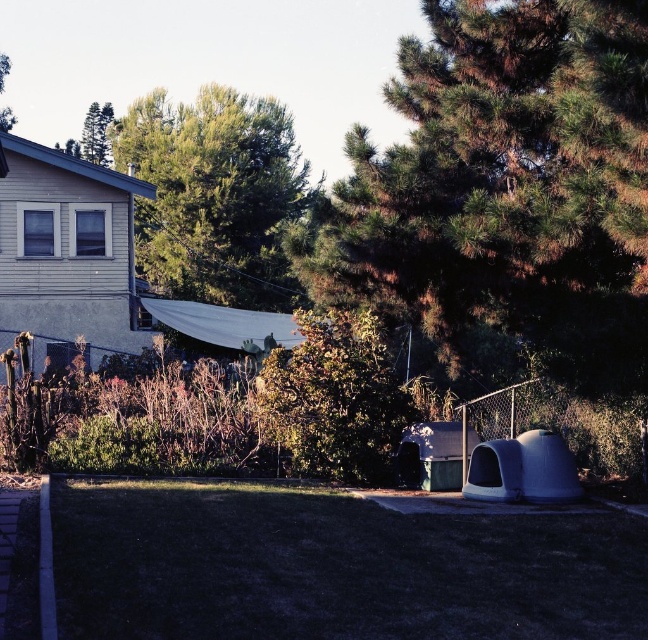
Question: Which object is the farthest from the green leafy tree at center?

Choices:
 (A) green textured tree at center
 (B) green textured tree at upper left
 (C) green leafy tree at upper center

Answer: (B)

Question: Does green leafy tree at upper center appear on the left side of green textured tree at upper left?

Choices:
 (A) no
 (B) yes

Answer: (A)

Question: Does green leafy tree at upper center appear on the left side of green textured tree at upper left?

Choices:
 (A) no
 (B) yes

Answer: (A)

Question: Considering the real-world distances, which object is farthest from the green textured tree at upper left?

Choices:
 (A) green textured tree at center
 (B) green leafy tree at upper left
 (C) green leafy tree at center
 (D) green leafy tree at upper center

Answer: (C)

Question: Is green leafy tree at center positioned behind green leafy tree at upper left?

Choices:
 (A) no
 (B) yes

Answer: (A)

Question: Which point is closer to the camera?

Choices:
 (A) green leafy tree at upper left
 (B) green leafy tree at upper center
 (C) green textured tree at upper left
 (D) green leafy tree at center

Answer: (D)